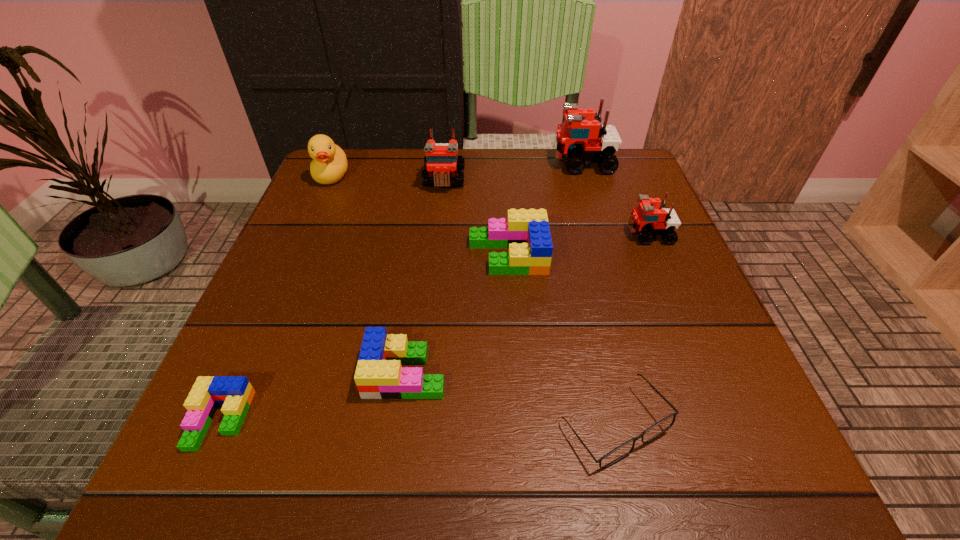
Identify the location of spectacles situated at the right edge. This screenshot has height=540, width=960. (620, 452).

At what (x,y) coordinates should I click in order to perform the action: click on object that is positioned at the far left corner. Please return your answer as a coordinate pair (x, y). Looking at the image, I should click on (329, 165).

At what (x,y) coordinates should I click in order to perform the action: click on object that is at the near left corner. Please return your answer as a coordinate pair (x, y). The width and height of the screenshot is (960, 540). Looking at the image, I should click on (235, 393).

Find the location of `object located in the far right corner section of the desktop`. object located in the far right corner section of the desktop is located at coordinates (582, 138).

In order to click on object situated at the near right corner in this screenshot , I will do `click(620, 452)`.

At what (x,y) coordinates should I click in order to perform the action: click on vacant space at the far edge. Please return your answer as a coordinate pair (x, y). Looking at the image, I should click on (485, 198).

The height and width of the screenshot is (540, 960). I want to click on free region at the near edge, so click(621, 476).

Locate an element on the screen. The image size is (960, 540). vacant space at the left edge of the desktop is located at coordinates (350, 264).

Identify the location of vacant space at the right edge of the desktop. The height and width of the screenshot is (540, 960). (727, 353).

Where is `vacant space at the far left corner of the desktop`? This screenshot has height=540, width=960. vacant space at the far left corner of the desktop is located at coordinates (371, 181).